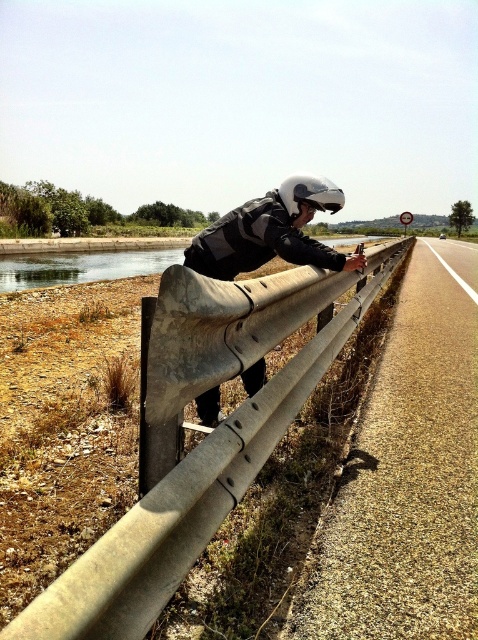
Between point (113, 593) and point (318, 179), which one is positioned in front?

Point (113, 593) is in front.

This screenshot has height=640, width=478. In order to click on concrete barrier at center in this screenshot , I will do `click(184, 502)`.

Locate an element on the screen. The height and width of the screenshot is (640, 478). concrete barrier at center is located at coordinates (184, 502).